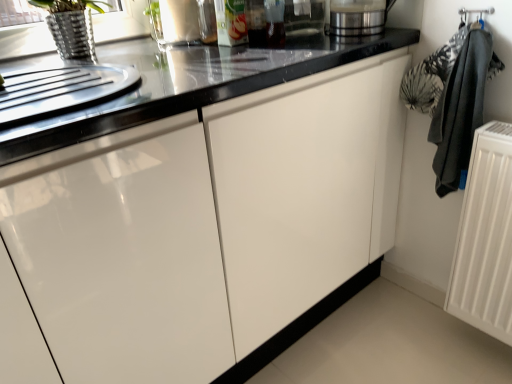
Question: Looking at their shapes, would you say white matte radiator at right is wider or thinner than black fabric laundry at right?

Choices:
 (A) wide
 (B) thin

Answer: (B)

Question: From a real-world perspective, is white matte radiator at right physically located above or below black fabric laundry at right?

Choices:
 (A) below
 (B) above

Answer: (A)

Question: Considering the real-world distances, which object is farthest from the satin silver blender at upper right, the 1th appliance positioned from the right?

Choices:
 (A) white matte radiator at right
 (B) metallic glass at upper center, the 2th appliance in the right-to-left sequence
 (C) black fabric laundry at right

Answer: (A)

Question: Which of these objects is positioned farthest from the satin silver blender at upper right, arranged as the second appliance when viewed from the left?

Choices:
 (A) white matte radiator at right
 (B) black fabric laundry at right
 (C) metallic glass at upper center, the 2th appliance in the right-to-left sequence

Answer: (A)